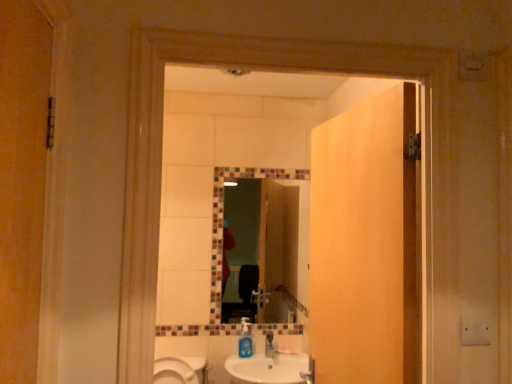
Question: Is point (348, 167) positioned closer to the camera than point (266, 360)?

Choices:
 (A) closer
 (B) farther

Answer: (A)

Question: Relative to white glossy sink at lower center, is matte wood door at center in front or behind?

Choices:
 (A) front
 (B) behind

Answer: (A)

Question: Which is nearer to the white glossy sink at lower center?

Choices:
 (A) multicolored mosaic mirror at center
 (B) blue translucent soap dispenser at center
 (C) matte wood door at center

Answer: (B)

Question: Estimate the real-world distances between objects in this image. Which object is farther from the multicolored mosaic mirror at center?

Choices:
 (A) matte wood door at center
 (B) white glossy sink at lower center
 (C) blue translucent soap dispenser at center

Answer: (A)